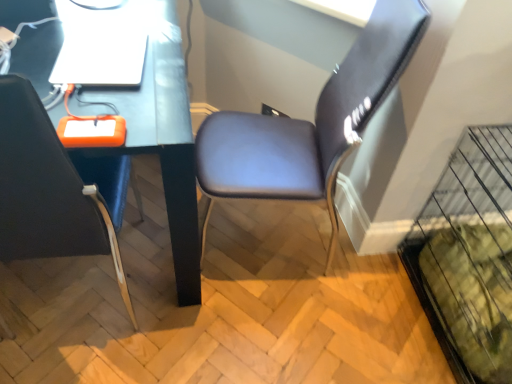
In order to face matte black desk at center, should I rotate leftwards or rightwards?

It's best to rotate left around 22.316 degrees.

The image size is (512, 384). Describe the element at coordinates (309, 124) in the screenshot. I see `suede-like brown chair at center-right, which is counted as the 1th chair, starting from the right` at that location.

Image resolution: width=512 pixels, height=384 pixels. I want to click on white glossy laptop at upper left, so click(x=100, y=44).

Considering the points (122, 68) and (63, 195), which point is behind, point (122, 68) or point (63, 195)?

Positioned behind is point (122, 68).

Considering the relative positions of white glossy laptop at upper left and matte black chair at left, which is the 1th chair from left to right, in the image provided, is white glossy laptop at upper left behind matte black chair at left, which is the 1th chair from left to right,?

Yes, it is behind matte black chair at left, which is the 1th chair from left to right.

From a real-world perspective, is white glossy laptop at upper left positioned over matte black chair at left, placed as the 2th chair when sorted from right to left, based on gravity?

Yes, from a real-world perspective, white glossy laptop at upper left is over matte black chair at left, placed as the 2th chair when sorted from right to left

Which of these two, white glossy laptop at upper left or matte black chair at left, placed as the 2th chair when sorted from right to left, stands taller?

matte black chair at left, placed as the 2th chair when sorted from right to left, is taller.

In the image, there is a matte black chair at left, placed as the 2th chair when sorted from right to left. Where is `computer above it (from the image's perspective)`? The image size is (512, 384). computer above it (from the image's perspective) is located at coordinates (100, 44).

Does matte black chair at left, placed as the 2th chair when sorted from right to left, lie in front of white glossy laptop at upper left?

Yes, matte black chair at left, placed as the 2th chair when sorted from right to left, is closer to the viewer.

Could you tell me if matte black chair at left, placed as the 2th chair when sorted from right to left, is facing white glossy laptop at upper left?

Yes, matte black chair at left, placed as the 2th chair when sorted from right to left, is aimed at white glossy laptop at upper left.

Is matte black desk at center facing away from matte black chair at left, placed as the 2th chair when sorted from right to left?

matte black desk at center does not have its back to matte black chair at left, placed as the 2th chair when sorted from right to left.

Who is taller, matte black desk at center or matte black chair at left, placed as the 2th chair when sorted from right to left?

With more height is matte black chair at left, placed as the 2th chair when sorted from right to left.

From the image's perspective, is matte black desk at center above or below matte black chair at left, placed as the 2th chair when sorted from right to left?

matte black desk at center is situated higher than matte black chair at left, placed as the 2th chair when sorted from right to left, in the image.

Locate an element on the screen. This screenshot has height=384, width=512. chair to the right of matte black chair at left, placed as the 2th chair when sorted from right to left is located at coordinates (309, 124).

Which of these two, matte black chair at left, placed as the 2th chair when sorted from right to left, or suede-like brown chair at center-right, which is counted as the 1th chair, starting from the right, stands shorter?

Standing shorter between the two is matte black chair at left, placed as the 2th chair when sorted from right to left.

Between matte black chair at left, placed as the 2th chair when sorted from right to left, and suede-like brown chair at center-right, which is counted as the 1th chair, starting from the right, which one appears on the right side from the viewer's perspective?

suede-like brown chair at center-right, which is counted as the 1th chair, starting from the right.

Considering the relative positions of suede-like brown chair at center-right, which appears as the 2th chair when viewed from the left, and matte black desk at center in the image provided, is suede-like brown chair at center-right, which appears as the 2th chair when viewed from the left, to the left or to the right of matte black desk at center?

Based on their positions, suede-like brown chair at center-right, which appears as the 2th chair when viewed from the left, is located to the right of matte black desk at center.

Relative to matte black desk at center, is suede-like brown chair at center-right, which appears as the 2th chair when viewed from the left, in front or behind?

In the image, suede-like brown chair at center-right, which appears as the 2th chair when viewed from the left, appears behind matte black desk at center.

From the image's perspective, is suede-like brown chair at center-right, which is counted as the 1th chair, starting from the right, located above matte black desk at center?

Yes.

Locate an element on the screen. computer that is behind the suede-like brown chair at center-right, which appears as the 2th chair when viewed from the left is located at coordinates (100, 44).

From a real-world perspective, is suede-like brown chair at center-right, which appears as the 2th chair when viewed from the left, physically located above or below white glossy laptop at upper left?

suede-like brown chair at center-right, which appears as the 2th chair when viewed from the left, is situated lower than white glossy laptop at upper left in the real world.

Is white glossy laptop at upper left at the back of suede-like brown chair at center-right, which appears as the 2th chair when viewed from the left?

suede-like brown chair at center-right, which appears as the 2th chair when viewed from the left, is not turned away from white glossy laptop at upper left.

Considering the sizes of objects suede-like brown chair at center-right, which appears as the 2th chair when viewed from the left, and matte black chair at left, placed as the 2th chair when sorted from right to left, in the image provided, who is taller, suede-like brown chair at center-right, which appears as the 2th chair when viewed from the left, or matte black chair at left, placed as the 2th chair when sorted from right to left,?

Standing taller between the two is suede-like brown chair at center-right, which appears as the 2th chair when viewed from the left.

Is suede-like brown chair at center-right, which appears as the 2th chair when viewed from the left, next to matte black chair at left, which is the 1th chair from left to right, and touching it?

There is a gap between suede-like brown chair at center-right, which appears as the 2th chair when viewed from the left, and matte black chair at left, which is the 1th chair from left to right.

Does suede-like brown chair at center-right, which is counted as the 1th chair, starting from the right, have a smaller size compared to matte black chair at left, which is the 1th chair from left to right?

Correct, suede-like brown chair at center-right, which is counted as the 1th chair, starting from the right, occupies less space than matte black chair at left, which is the 1th chair from left to right.

Is suede-like brown chair at center-right, which is counted as the 1th chair, starting from the right, thinner than matte black chair at left, placed as the 2th chair when sorted from right to left?

Yes, suede-like brown chair at center-right, which is counted as the 1th chair, starting from the right, is thinner than matte black chair at left, placed as the 2th chair when sorted from right to left.

I want to click on computer behind the matte black chair at left, placed as the 2th chair when sorted from right to left, so click(100, 44).

Where is `the 2nd chair below the white glossy laptop at upper left (from the image's perspective)`? The height and width of the screenshot is (384, 512). the 2nd chair below the white glossy laptop at upper left (from the image's perspective) is located at coordinates (54, 189).

From the image, which object appears to be farther from matte black chair at left, placed as the 2th chair when sorted from right to left, matte black desk at center or suede-like brown chair at center-right, which appears as the 2th chair when viewed from the left?

The object further to matte black chair at left, placed as the 2th chair when sorted from right to left, is suede-like brown chair at center-right, which appears as the 2th chair when viewed from the left.

Considering their positions, is matte black desk at center positioned further to suede-like brown chair at center-right, which is counted as the 1th chair, starting from the right, than matte black chair at left, which is the 1th chair from left to right?

Among the two, matte black chair at left, which is the 1th chair from left to right, is located further to suede-like brown chair at center-right, which is counted as the 1th chair, starting from the right.

Based on their spatial positions, is matte black chair at left, placed as the 2th chair when sorted from right to left, or matte black desk at center closer to white glossy laptop at upper left?

Based on the image, matte black desk at center appears to be nearer to white glossy laptop at upper left.

Considering their positions, is white glossy laptop at upper left positioned further to suede-like brown chair at center-right, which is counted as the 1th chair, starting from the right, than matte black desk at center?

white glossy laptop at upper left lies further to suede-like brown chair at center-right, which is counted as the 1th chair, starting from the right, than the other object.

Based on their spatial positions, is suede-like brown chair at center-right, which is counted as the 1th chair, starting from the right, or matte black chair at left, which is the 1th chair from left to right, further from matte black desk at center?

suede-like brown chair at center-right, which is counted as the 1th chair, starting from the right, is positioned further to the anchor matte black desk at center.

When comparing their distances from matte black chair at left, which is the 1th chair from left to right, does suede-like brown chair at center-right, which appears as the 2th chair when viewed from the left, or white glossy laptop at upper left seem further?

suede-like brown chair at center-right, which appears as the 2th chair when viewed from the left, is positioned further to the anchor matte black chair at left, which is the 1th chair from left to right.

When comparing their distances from white glossy laptop at upper left, does matte black desk at center or matte black chair at left, which is the 1th chair from left to right, seem closer?

Among the two, matte black desk at center is located nearer to white glossy laptop at upper left.

Looking at the image, which one is located closer to white glossy laptop at upper left, suede-like brown chair at center-right, which is counted as the 1th chair, starting from the right, or matte black desk at center?

The object closer to white glossy laptop at upper left is matte black desk at center.

At what (x,y) coordinates should I click in order to perform the action: click on computer between matte black desk at center and suede-like brown chair at center-right, which is counted as the 1th chair, starting from the right, in the horizontal direction. Please return your answer as a coordinate pair (x, y). The width and height of the screenshot is (512, 384). Looking at the image, I should click on (100, 44).

Locate an element on the screen. The image size is (512, 384). computer desk positioned between matte black chair at left, which is the 1th chair from left to right, and white glossy laptop at upper left from near to far is located at coordinates (164, 140).

Locate an element on the screen. The width and height of the screenshot is (512, 384). chair between matte black desk at center and suede-like brown chair at center-right, which appears as the 2th chair when viewed from the left, in the horizontal direction is located at coordinates (54, 189).

Find the location of `computer between matte black chair at left, which is the 1th chair from left to right, and suede-like brown chair at center-right, which is counted as the 1th chair, starting from the right`. computer between matte black chair at left, which is the 1th chair from left to right, and suede-like brown chair at center-right, which is counted as the 1th chair, starting from the right is located at coordinates (100, 44).